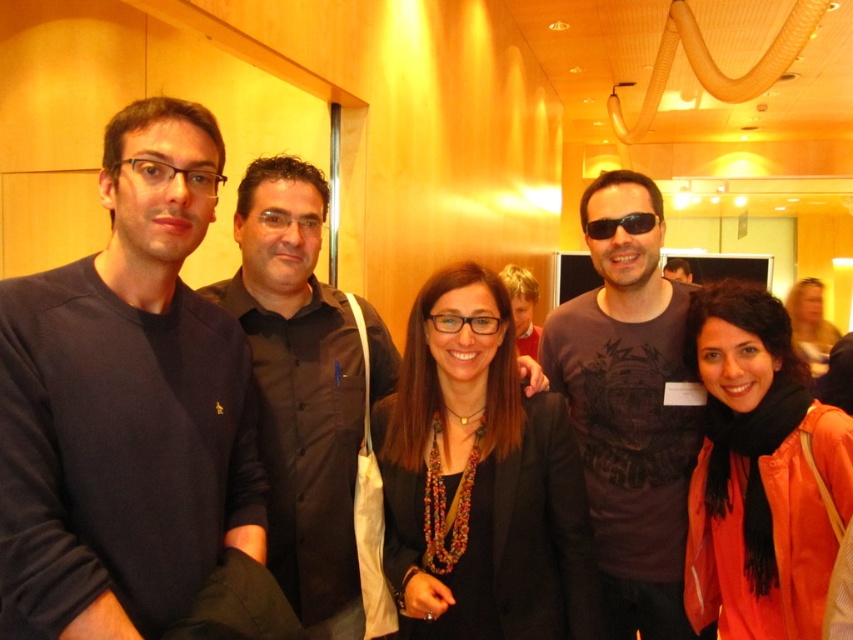
Question: Estimate the real-world distances between objects in this image. Which object is farther from the black shirt at center?

Choices:
 (A) matte black sweater at left
 (B) dark brown printed t-shirt at center
 (C) matte black blazer at center

Answer: (B)

Question: Is orange matte jacket at center positioned in front of black plastic sunglasses at center?

Choices:
 (A) yes
 (B) no

Answer: (A)

Question: Does dark brown printed t-shirt at center come in front of orange matte jacket at center?

Choices:
 (A) yes
 (B) no

Answer: (B)

Question: Is black shirt at center further to the viewer compared to matte black jacket at upper right?

Choices:
 (A) no
 (B) yes

Answer: (A)

Question: Which is nearer to the black plastic sunglasses at center?

Choices:
 (A) matte black blazer at center
 (B) black shirt at center
 (C) dark brown printed t-shirt at center

Answer: (C)

Question: Which point is farther to the camera?

Choices:
 (A) (804, 339)
 (B) (363, 362)
 (C) (96, 364)

Answer: (A)